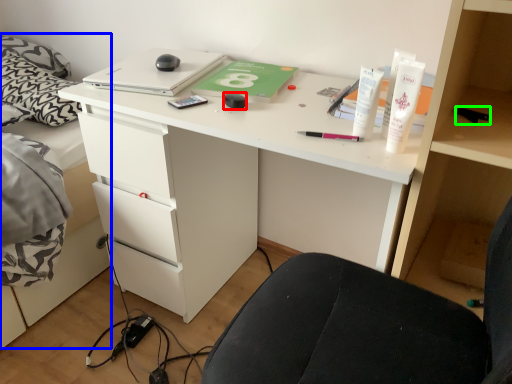
Question: Based on their relative distances, which object is nearer to stationery (highlighted by a red box)? Choose from bed (highlighted by a blue box) and stationery (highlighted by a green box).

Choices:
 (A) bed
 (B) stationery

Answer: (B)